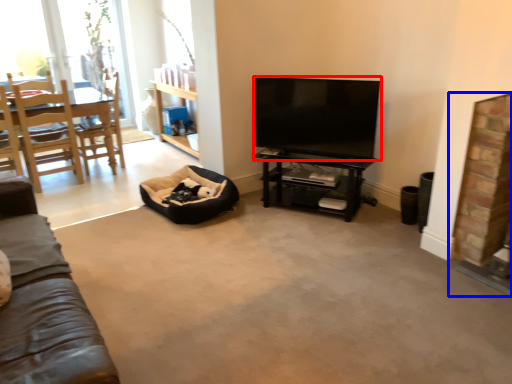
Question: Among these objects, which one is farthest to the camera, television (highlighted by a red box) or fireplace (highlighted by a blue box)?

Choices:
 (A) television
 (B) fireplace

Answer: (A)